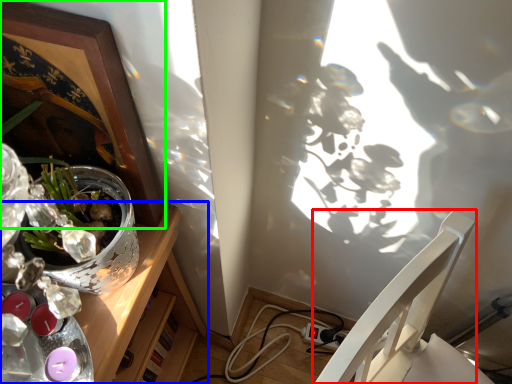
Question: Based on their relative distances, which object is farther from chair (highlighted by a red box)? Choose from desk (highlighted by a blue box) and picture frame (highlighted by a green box).

Choices:
 (A) desk
 (B) picture frame

Answer: (B)